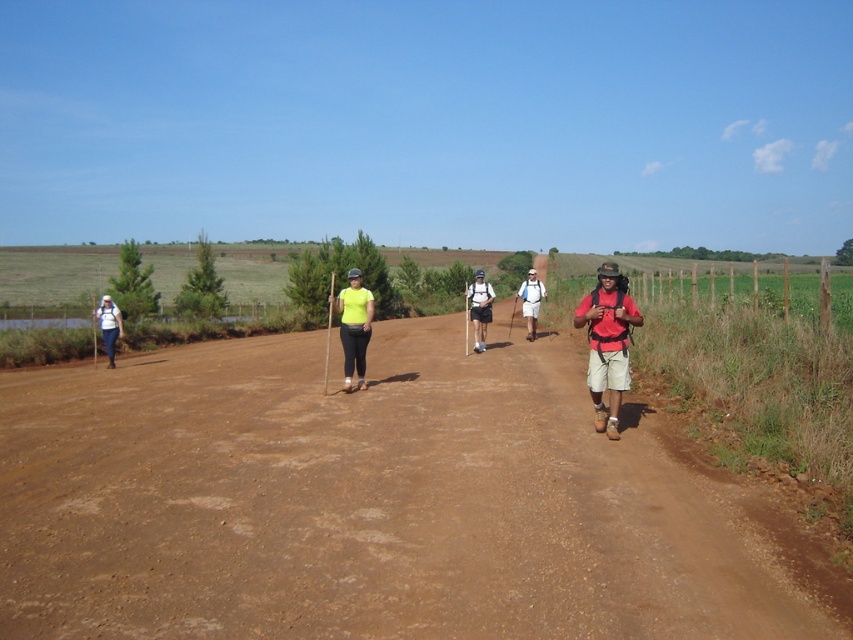
Question: Which object is closer to the camera taking this photo?

Choices:
 (A) matte black backpack at center
 (B) brown dirt track at center
 (C) matte white backpack at center
 (D) matte red shirt at center

Answer: (B)

Question: In this image, where is brown dirt track at center located relative to neon yellow t-shirt at center?

Choices:
 (A) right
 (B) left

Answer: (B)

Question: Which point is farther to the camera?

Choices:
 (A) brown dirt track at center
 (B) matte red shirt at center
 (C) matte white backpack at left
 (D) neon yellow t-shirt at center

Answer: (C)

Question: Is brown dirt track at center to the left of matte white backpack at left from the viewer's perspective?

Choices:
 (A) no
 (B) yes

Answer: (A)

Question: Estimate the real-world distances between objects in this image. Which object is closer to the matte white backpack at center?

Choices:
 (A) matte white backpack at left
 (B) neon yellow t-shirt at center
 (C) matte black backpack at center
 (D) brown dirt track at center

Answer: (C)

Question: In this image, where is matte white backpack at left located relative to matte white backpack at center?

Choices:
 (A) right
 (B) left

Answer: (B)